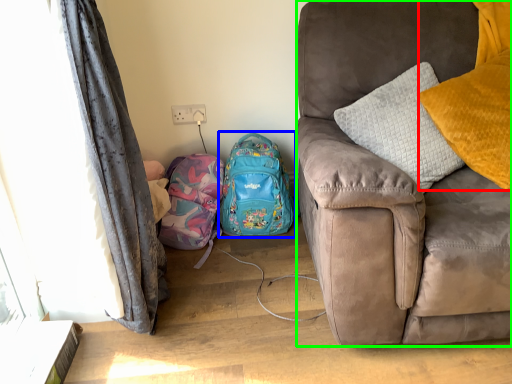
Question: Which object is the closest to the pillow (highlighted by a red box)? Choose among these: backpack (highlighted by a blue box) or studio couch (highlighted by a green box).

Choices:
 (A) backpack
 (B) studio couch

Answer: (B)